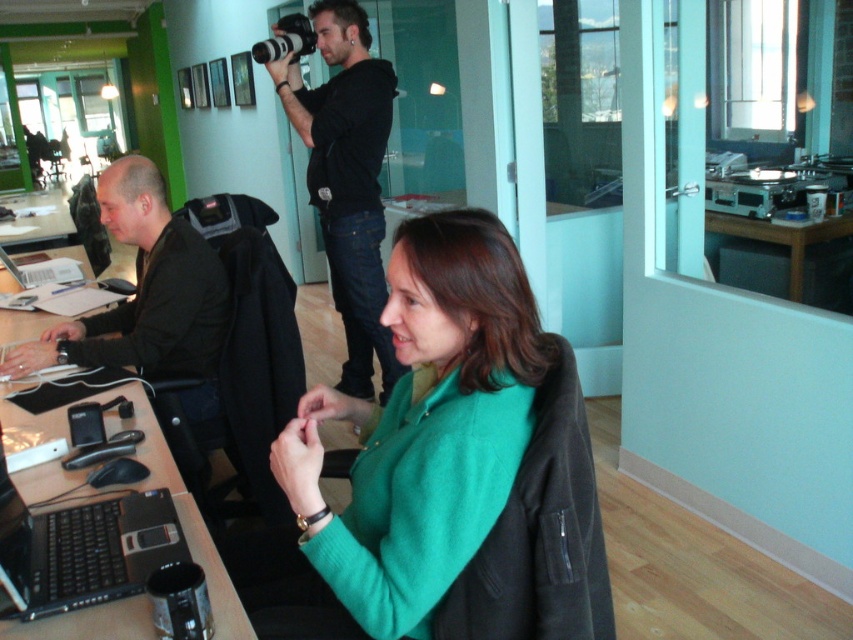
What object is located at the coordinates point (347, 179)?

The black cotton hoodie at upper center is located at point (347, 179).

You are navigating through the office and need to reach a point closer to you. Which of the two points, point (383, 67) or point (212, 276), should you head towards?

Point (383, 67) is closer to the viewer, so you should head towards point (383, 67).